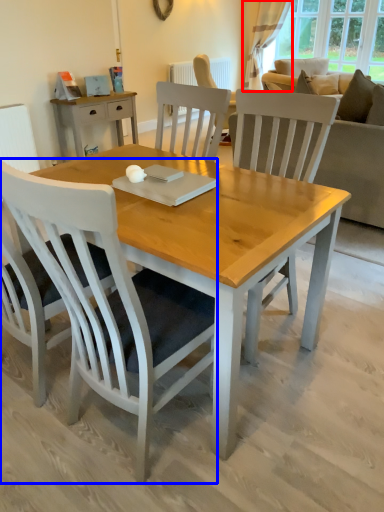
Question: Among these objects, which one is farthest to the camera, curtain (highlighted by a red box) or chair (highlighted by a blue box)?

Choices:
 (A) curtain
 (B) chair

Answer: (A)